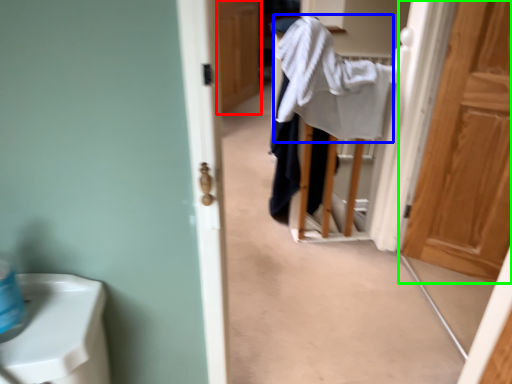
Question: Considering the real-world distances, which object is closest to door (highlighted by a red box)? bath towel (highlighted by a blue box) or door (highlighted by a green box).

Choices:
 (A) bath towel
 (B) door

Answer: (A)